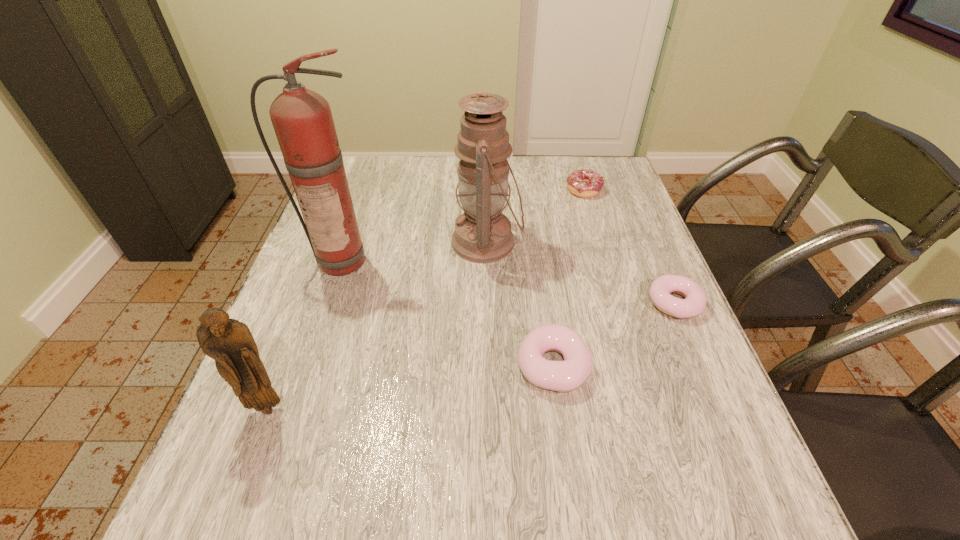
Where is `doughnut object that ranks as the second closest to the tallest object`? doughnut object that ranks as the second closest to the tallest object is located at coordinates (586, 183).

Where is `blank space that satisfies the following two spatial constraints: 1. on the front side of the second doughnut from left to right; 2. on the right side of the rightmost object`? blank space that satisfies the following two spatial constraints: 1. on the front side of the second doughnut from left to right; 2. on the right side of the rightmost object is located at coordinates (618, 303).

You are a GUI agent. You are given a task and a screenshot of the screen. Output one action in this format:
    pyautogui.click(x=<x>, y=<y>)
    Task: Click on the vacant space that satisfies the following two spatial constraints: 1. on the side of the nearest doughnut with the label and nozzle; 2. on the right side of the tallest object
    
    Given the screenshot: What is the action you would take?
    pyautogui.click(x=308, y=365)

Find the location of a particular element. This screenshot has height=540, width=960. free space in the image that satisfies the following two spatial constraints: 1. on the front side of the oil lamp; 2. on the right side of the leftmost doughnut is located at coordinates (489, 365).